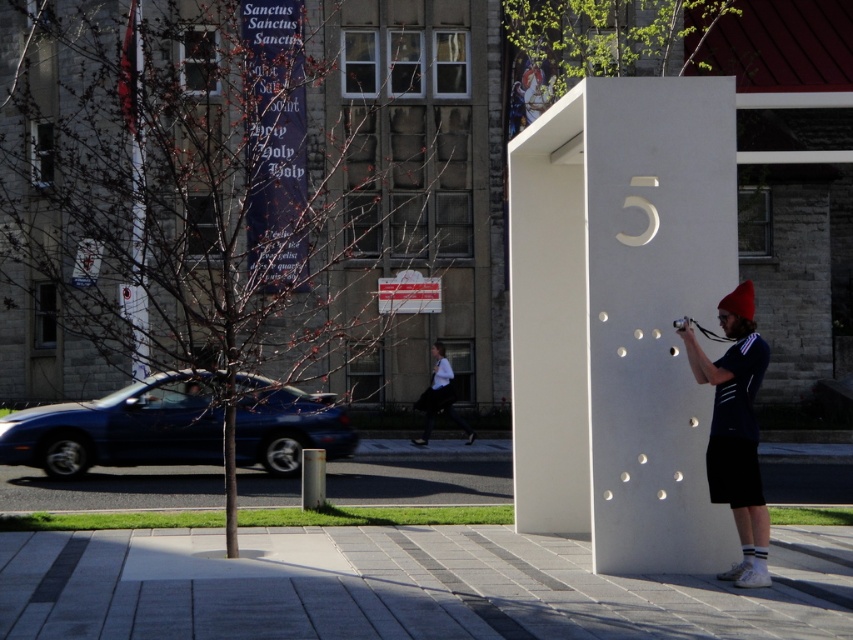
Question: Is white smooth pillar at center positioned behind matte black shirt at center?

Choices:
 (A) no
 (B) yes

Answer: (B)

Question: Which point is farther from the camera taking this photo?

Choices:
 (A) (654, 387)
 (B) (740, 288)

Answer: (A)

Question: Which of the following is the closest to the observer?

Choices:
 (A) (721, 362)
 (B) (515, 272)

Answer: (A)

Question: Is matte black shirt at center positioned behind white shirt at center?

Choices:
 (A) yes
 (B) no

Answer: (B)

Question: Which of the following is the closest to the observer?

Choices:
 (A) white shirt at center
 (B) white smooth pillar at center
 (C) matte black shirt at center

Answer: (C)

Question: In this image, where is matte black shirt at center located relative to white shirt at center?

Choices:
 (A) below
 (B) above

Answer: (B)